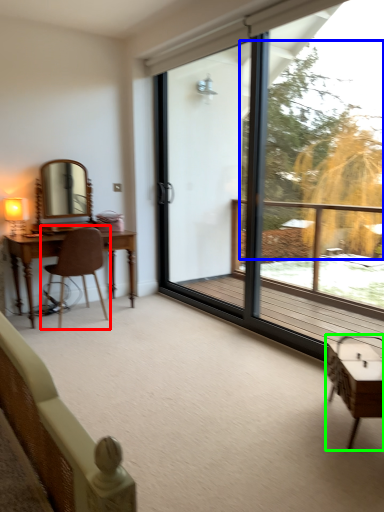
Question: Considering the real-world distances, which object is closest to chair (highlighted by a red box)? tree (highlighted by a blue box) or table (highlighted by a green box).

Choices:
 (A) tree
 (B) table

Answer: (B)